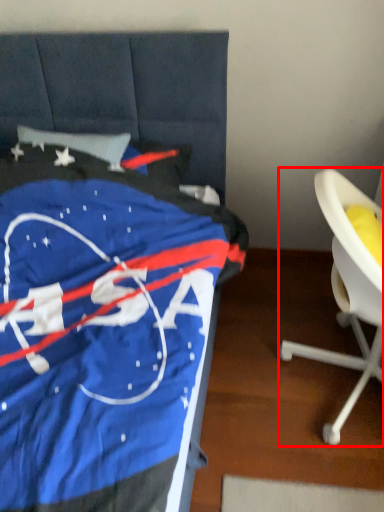
Question: From the image's perspective, considering the relative positions of chair (annotated by the red box) and furniture in the image provided, where is chair (annotated by the red box) located with respect to the staircase?

Choices:
 (A) below
 (B) above

Answer: (A)